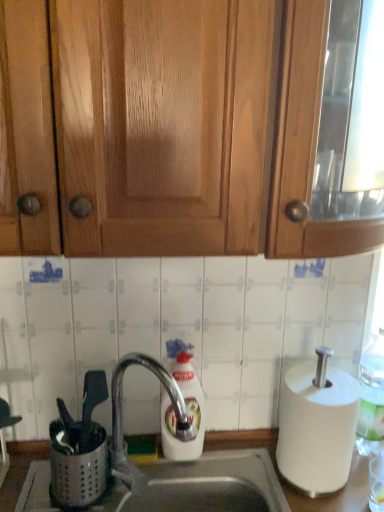
Question: Is wooden cabinet at upper center completely or partially inside metallic stainless steel sink at lower center?

Choices:
 (A) yes
 (B) no

Answer: (B)

Question: Can you confirm if metallic stainless steel sink at lower center is wider than wooden cabinet at upper center?

Choices:
 (A) yes
 (B) no

Answer: (B)

Question: Can you confirm if metallic stainless steel sink at lower center is smaller than wooden cabinet at upper center?

Choices:
 (A) yes
 (B) no

Answer: (A)

Question: Is metallic stainless steel sink at lower center thinner than wooden cabinet at upper center?

Choices:
 (A) yes
 (B) no

Answer: (A)

Question: From the image's perspective, is metallic stainless steel sink at lower center beneath wooden cabinet at upper center?

Choices:
 (A) yes
 (B) no

Answer: (A)

Question: Considering the relative sizes of metallic stainless steel sink at lower center and wooden cabinet at upper center in the image provided, is metallic stainless steel sink at lower center taller than wooden cabinet at upper center?

Choices:
 (A) yes
 (B) no

Answer: (B)

Question: Considering the relative sizes of white matte paper towel at right and white plastic bottle at right in the image provided, is white matte paper towel at right thinner than white plastic bottle at right?

Choices:
 (A) no
 (B) yes

Answer: (A)

Question: From a real-world perspective, does white matte paper towel at right stand above white plastic bottle at right?

Choices:
 (A) no
 (B) yes

Answer: (A)

Question: Would you say white plastic bottle at right is part of white matte paper towel at right's contents?

Choices:
 (A) no
 (B) yes

Answer: (A)

Question: Is white matte paper towel at right aimed at white plastic bottle at right?

Choices:
 (A) no
 (B) yes

Answer: (A)

Question: From a real-world perspective, does white matte paper towel at right sit lower than white plastic bottle at right?

Choices:
 (A) yes
 (B) no

Answer: (A)

Question: Can you confirm if white matte paper towel at right is wider than white plastic bottle at right?

Choices:
 (A) no
 (B) yes

Answer: (B)

Question: From the image's perspective, is metallic stainless steel sink at lower center located above white matte paper towel at right?

Choices:
 (A) yes
 (B) no

Answer: (B)